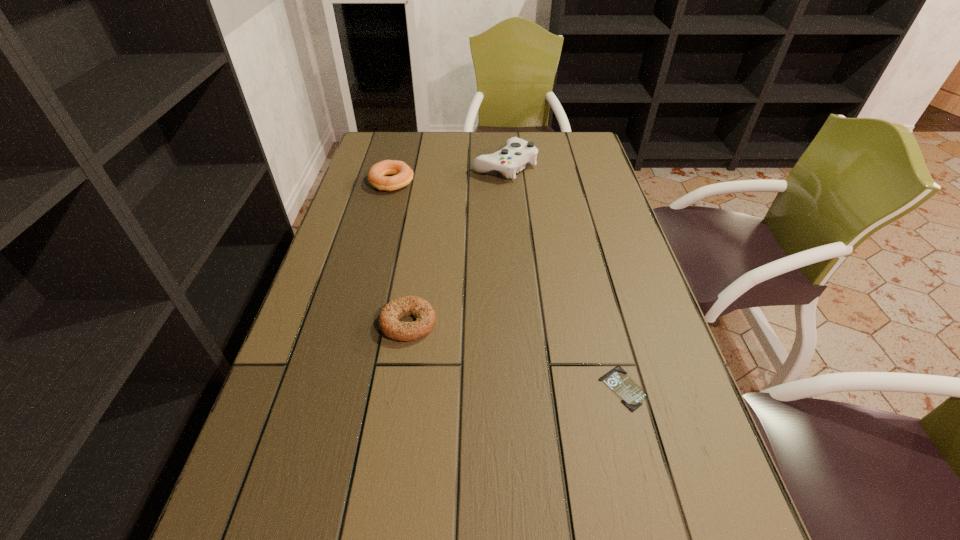
Identify the location of control. (517, 152).

Where is `the tallest object`? the tallest object is located at coordinates (517, 152).

This screenshot has height=540, width=960. Identify the location of the taller bagel. (378, 177).

Where is `the third shortest object`? the third shortest object is located at coordinates (378, 177).

The width and height of the screenshot is (960, 540). Identify the location of the shorter bagel. (388, 319).

Find the location of a particular element. Image resolution: width=960 pixels, height=540 pixels. the nearer bagel is located at coordinates (388, 319).

Find the location of a particular element. the nearest object is located at coordinates (631, 394).

You are a GUI agent. You are given a task and a screenshot of the screen. Output one action in this format:
    pyautogui.click(x=<x>, y=<y>)
    Task: Click on the identity card
    The image size is (960, 540).
    Given the screenshot: What is the action you would take?
    pyautogui.click(x=631, y=394)

Locate an element on the screen. The height and width of the screenshot is (540, 960). vacant area situated on the left of the second object from right to left is located at coordinates (426, 166).

Locate an element on the screen. free region located on the left of the taller bagel is located at coordinates (353, 183).